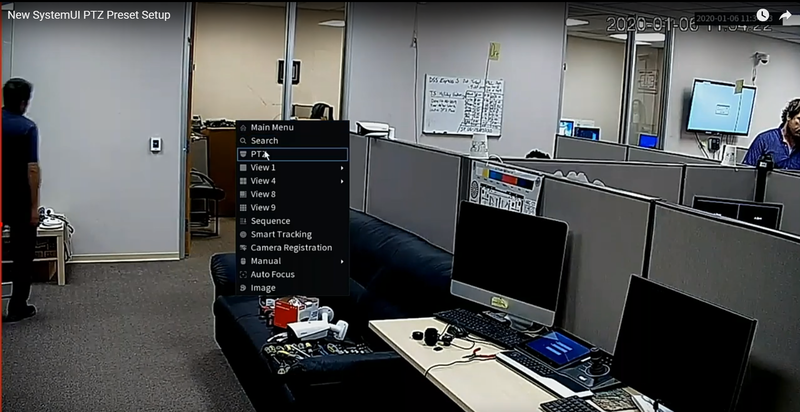
The height and width of the screenshot is (412, 800). I want to click on light switch, so click(154, 147).